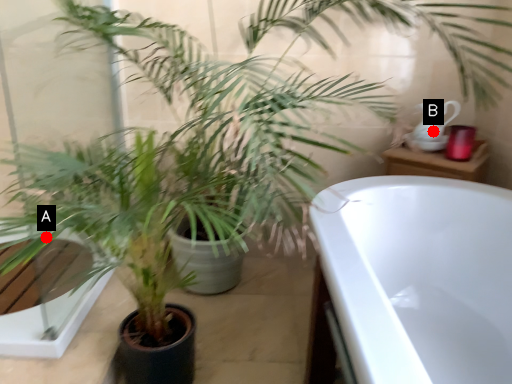
Question: Two points are circled on the image, labeled by A and B beside each circle. Which point appears closest to the camera in this image?

Choices:
 (A) A is closer
 (B) B is closer

Answer: (A)